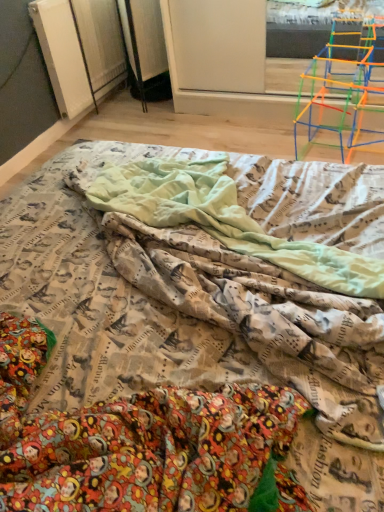
Question: Based on their sizes in the image, would you say printed fabric blanket at center is bigger or smaller than translucent plastic toy at upper right?

Choices:
 (A) small
 (B) big

Answer: (A)

Question: Visually, is printed fabric blanket at center positioned to the left or to the right of translucent plastic toy at upper right?

Choices:
 (A) left
 (B) right

Answer: (A)

Question: Which object is the closest to the translucent plastic toy at upper right?

Choices:
 (A) printed fabric bed at center
 (B) printed fabric blanket at center

Answer: (B)

Question: Estimate the real-world distances between objects in this image. Which object is closer to the translucent plastic toy at upper right?

Choices:
 (A) printed fabric bed at center
 (B) printed fabric blanket at center

Answer: (B)